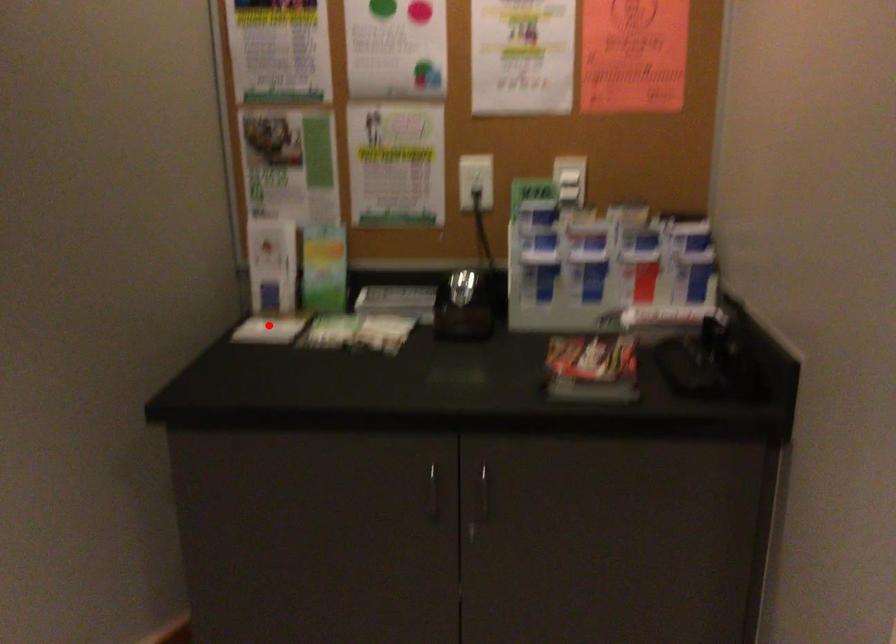
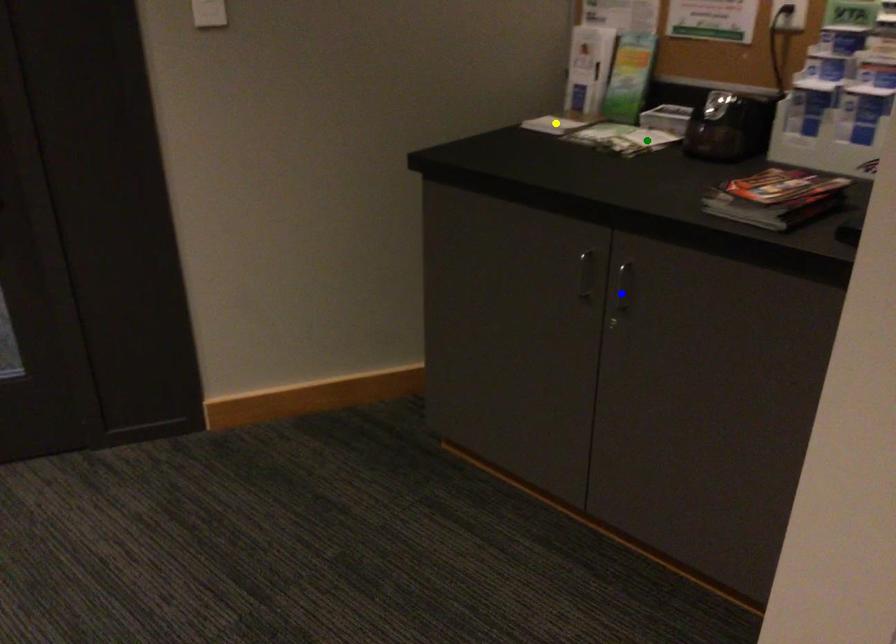
Question: I am providing you with two images of the same scene from different viewpoints. A red point is marked on the first image. You are given multiple points on the second image. Which spot in image 2 lines up with the point in image 1?

Choices:
 (A) green point
 (B) blue point
 (C) yellow point

Answer: (C)